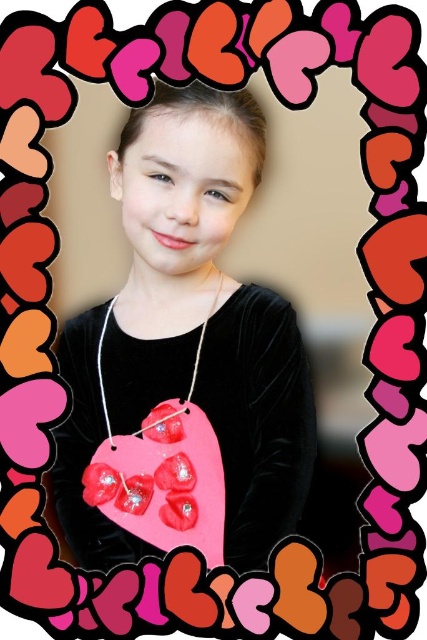
Which is below, matte pink heart at center or matte velvet heart at center?

matte velvet heart at center is below.

Can you confirm if matte pink heart at center is thinner than matte velvet heart at center?

In fact, matte pink heart at center might be wider than matte velvet heart at center.

Find the location of a particular element. The width and height of the screenshot is (427, 640). matte pink heart at center is located at coordinates (189, 332).